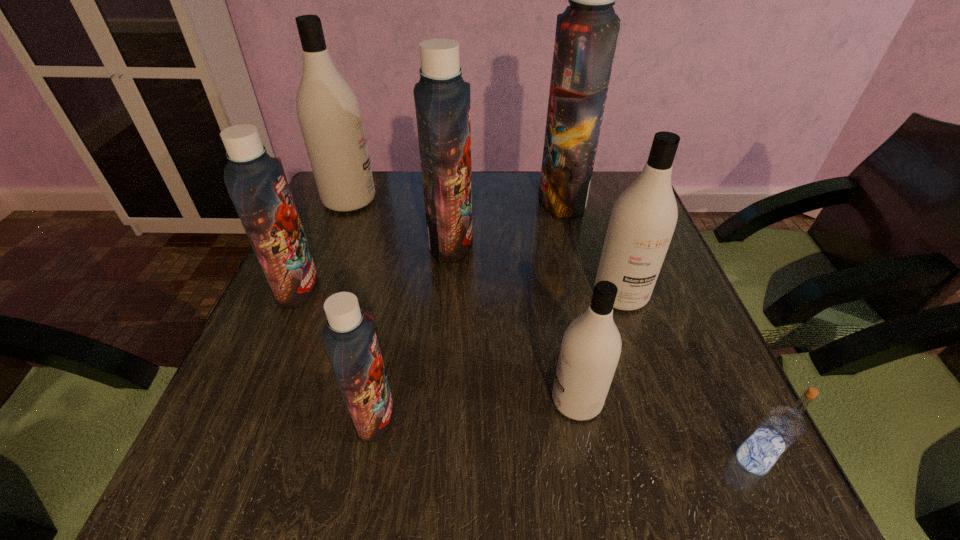
At what (x,y) coordinates should I click in order to perform the action: click on the tallest shampoo. Please return your answer as a coordinate pair (x, y). Looking at the image, I should click on (586, 35).

The image size is (960, 540). Identify the location of the tallest object. (586, 35).

This screenshot has height=540, width=960. I want to click on the leftmost white shampoo, so click(x=329, y=114).

Where is `the biggest white shampoo`? the biggest white shampoo is located at coordinates (329, 114).

At what (x,y) coordinates should I click in order to perform the action: click on the fourth shampoo from left to right. Please return your answer as a coordinate pair (x, y). The width and height of the screenshot is (960, 540). Looking at the image, I should click on (442, 98).

Find the location of a particular element. The height and width of the screenshot is (540, 960). the fifth object from right to left is located at coordinates (442, 98).

This screenshot has height=540, width=960. What are the coordinates of `the leftmost blue shampoo` in the screenshot? It's located at (257, 184).

Where is `the rightmost white shampoo`? This screenshot has width=960, height=540. the rightmost white shampoo is located at coordinates (643, 219).

Where is `the second biggest white shampoo`? This screenshot has width=960, height=540. the second biggest white shampoo is located at coordinates (643, 219).

Find the location of `the second blue shampoo from left to right`. the second blue shampoo from left to right is located at coordinates (350, 340).